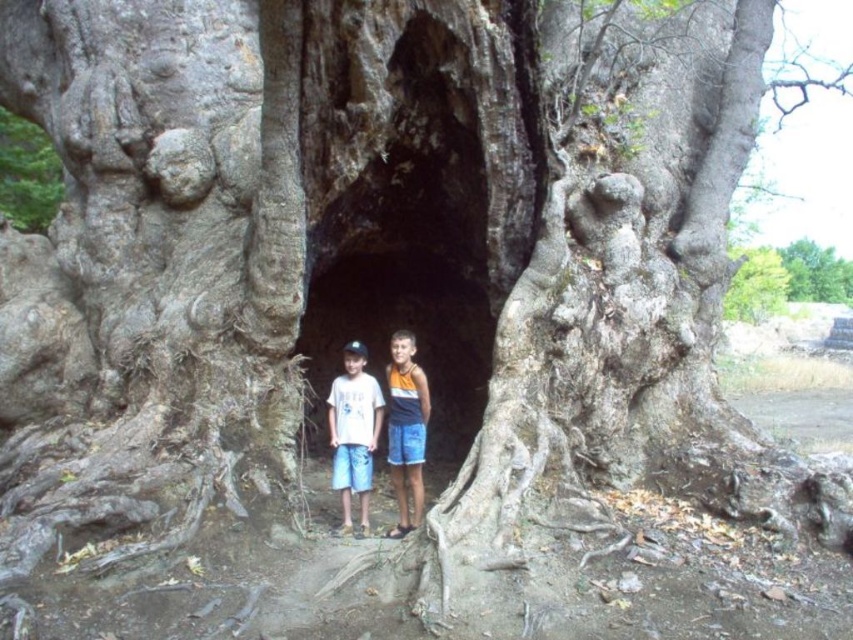
Question: Does matte white t-shirt at center have a greater width compared to green rough bark tree at upper right?

Choices:
 (A) yes
 (B) no

Answer: (B)

Question: Does white cotton shorts at center appear under blue shorts at center?

Choices:
 (A) no
 (B) yes

Answer: (A)

Question: Which object is farther from the camera taking this photo?

Choices:
 (A) blue shorts at center
 (B) smooth gray bark at center
 (C) white cotton shorts at center

Answer: (B)

Question: Is matte white t-shirt at center below smooth gray bark at center?

Choices:
 (A) yes
 (B) no

Answer: (A)

Question: Considering the real-world distances, which object is closest to the green leafy tree at upper center?

Choices:
 (A) green rough bark tree at upper right
 (B) smooth gray bark at center
 (C) blue shorts at center

Answer: (A)

Question: Which object is closer to the camera taking this photo?

Choices:
 (A) matte white t-shirt at center
 (B) white cotton shorts at center
 (C) green leafy tree at upper center
 (D) blue shorts at center

Answer: (B)